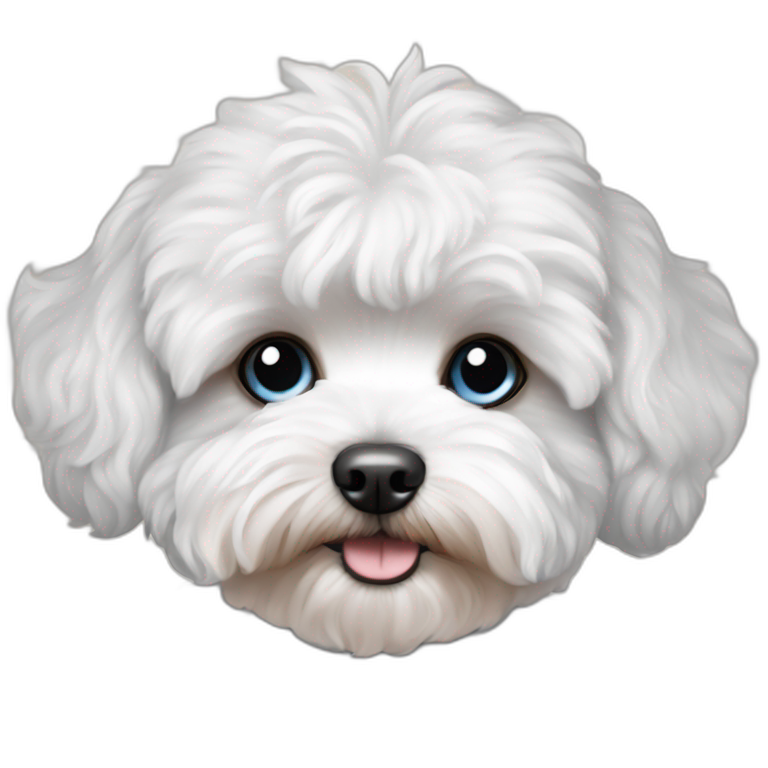
At what (x,y) coordinates should I click in order to perform the action: click on white fur. Please return your answer as a coordinate pair (x, y). Looking at the image, I should click on (339, 255).